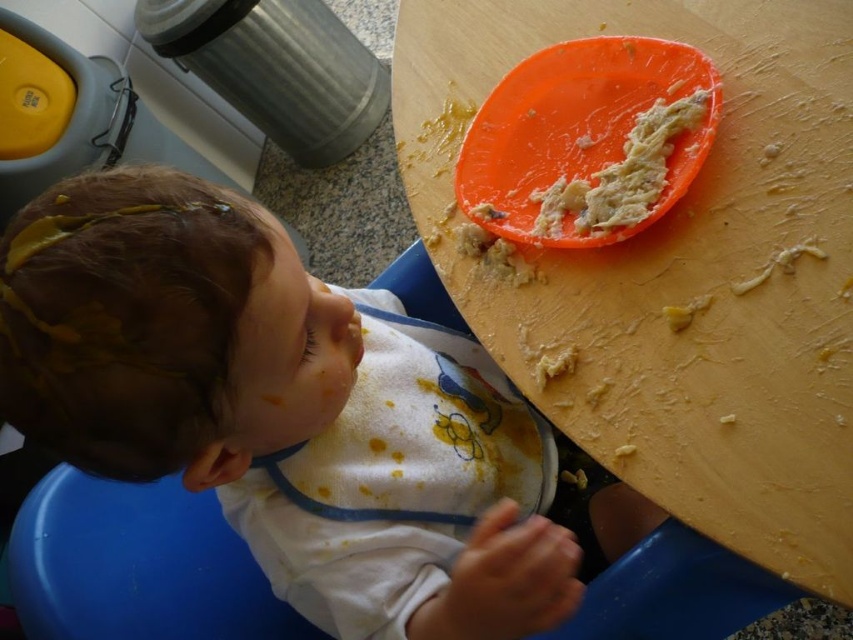
Can you confirm if matte white bib at lower center is positioned above orange plastic table at upper right?

Actually, matte white bib at lower center is below orange plastic table at upper right.

Is point (440, 484) behind point (849, 508)?

Yes.

Between point (219, 394) and point (776, 298), which one is positioned behind?

Positioned behind is point (776, 298).

Where is `matte white bib at lower center`? Image resolution: width=853 pixels, height=640 pixels. matte white bib at lower center is located at coordinates (276, 406).

What do you see at coordinates (677, 269) in the screenshot? I see `orange plastic table at upper right` at bounding box center [677, 269].

Does orange plastic table at upper right have a larger size compared to orange plastic plate at upper center?

Indeed, orange plastic table at upper right has a larger size compared to orange plastic plate at upper center.

Does point (819, 593) come behind point (653, 104)?

No, it is in front of (653, 104).

The height and width of the screenshot is (640, 853). In order to click on orange plastic table at upper right in this screenshot , I will do `click(677, 269)`.

Does point (494, 392) come closer to viewer compared to point (653, 122)?

No, (494, 392) is behind (653, 122).

Is matte white bib at lower center to the left of orange plastic plate at upper center from the viewer's perspective?

Yes, matte white bib at lower center is to the left of orange plastic plate at upper center.

Which is in front, point (97, 202) or point (593, 147)?

Positioned in front is point (97, 202).

Find the location of a particular element. The width and height of the screenshot is (853, 640). matte white bib at lower center is located at coordinates (276, 406).